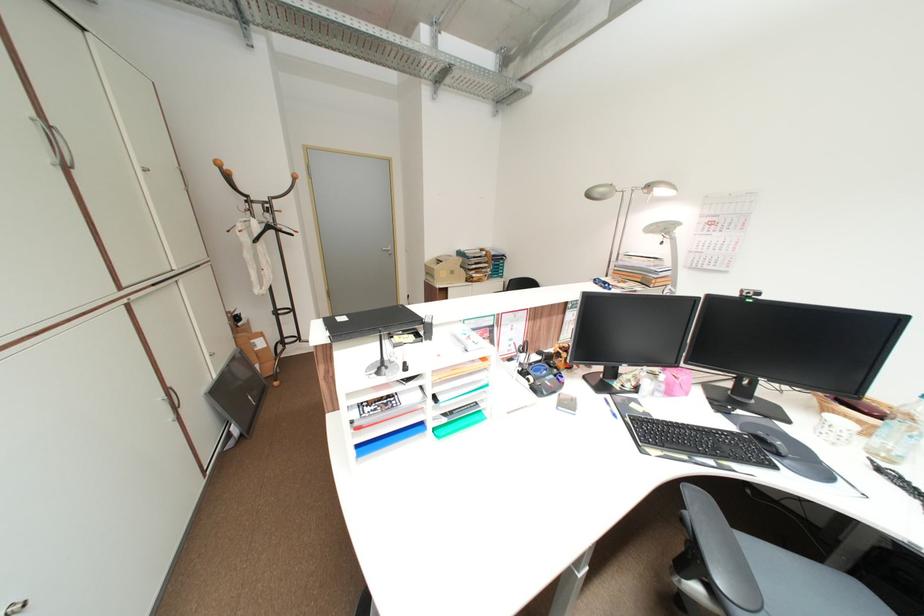
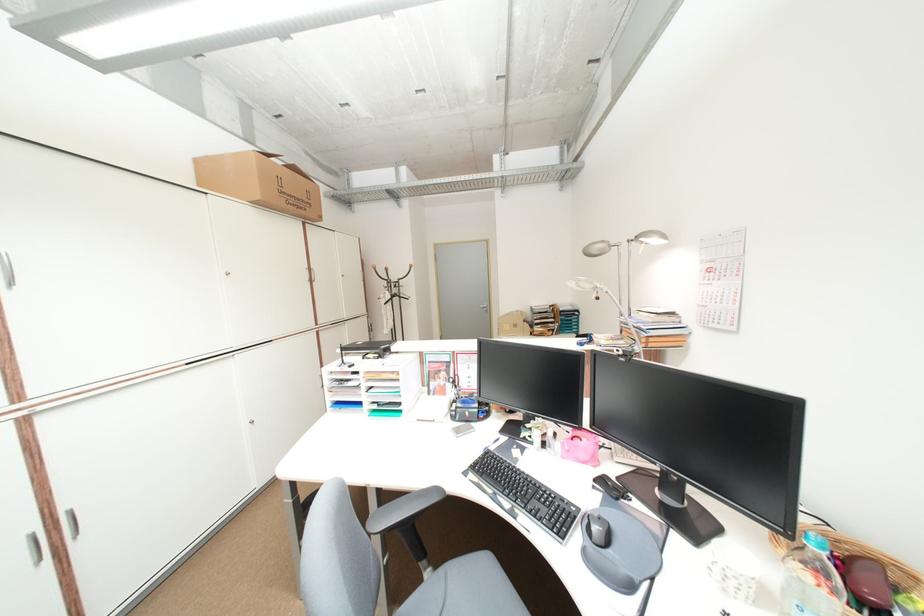
Question: I am providing you with two images of the same scene from different viewpoints. Which of the following objects are not visible in image2?

Choices:
 (A) grey chair sitting surface
 (B) plastic water bottle
 (C) cardboard box
 (D) none of these

Answer: (D)